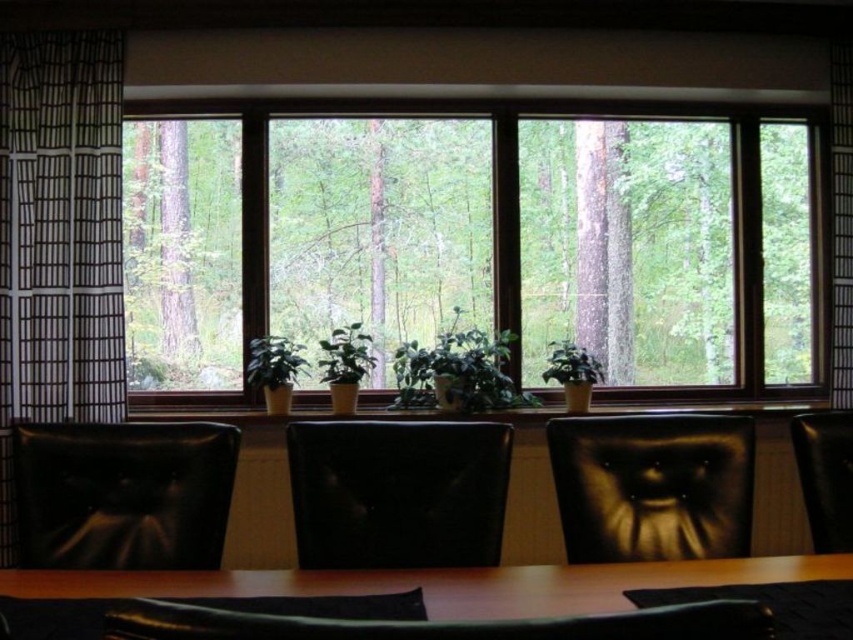
Based on the photo, is black leather armchair at center to the left of green matte plant at center from the viewer's perspective?

Indeed, black leather armchair at center is positioned on the left side of green matte plant at center.

Does black leather armchair at center appear over green matte plant at center?

Actually, black leather armchair at center is below green matte plant at center.

Where is `black leather armchair at center`? black leather armchair at center is located at coordinates (397, 492).

At what (x,y) coordinates should I click in order to perform the action: click on black leather armchair at left. Please return your answer as a coordinate pair (x, y). Image resolution: width=853 pixels, height=640 pixels. Looking at the image, I should click on (123, 493).

Who is taller, black leather armchair at left or brown wooden table at center?

black leather armchair at left is taller.

Who is more forward, (169, 561) or (173, 579)?

Point (173, 579)

You are a GUI agent. You are given a task and a screenshot of the screen. Output one action in this format:
    pyautogui.click(x=<x>, y=<y>)
    Task: Click on the black leather armchair at left
    Image resolution: width=853 pixels, height=640 pixels.
    Given the screenshot: What is the action you would take?
    [x=123, y=493]

Which is above, transparent glass window at center or black paper at left?

transparent glass window at center is above.

Which is below, transparent glass window at center or black paper at left?

black paper at left

Between point (706, 371) and point (64, 60), which one is positioned in front?

Point (64, 60) is more forward.

Locate an element on the screen. Image resolution: width=853 pixels, height=640 pixels. transparent glass window at center is located at coordinates (653, 253).